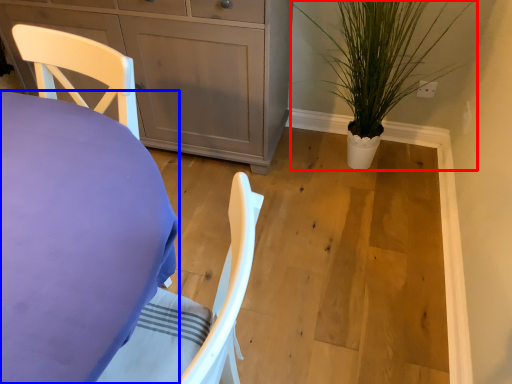
Question: Which object appears closest to the camera in this image, houseplant (highlighted by a red box) or desk (highlighted by a blue box)?

Choices:
 (A) houseplant
 (B) desk

Answer: (B)